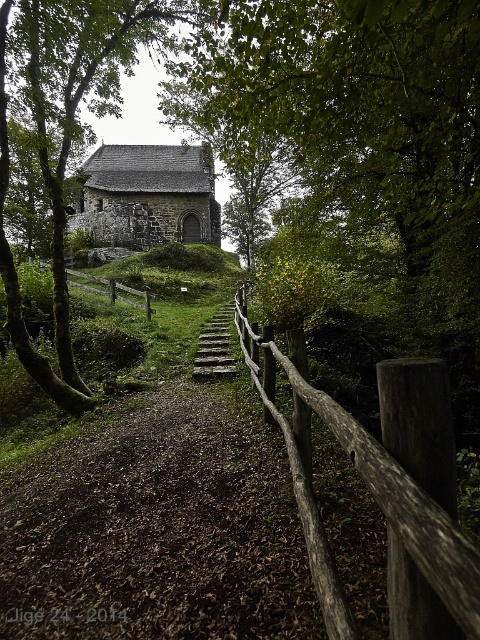
Question: Which is nearer to the stone church at center?

Choices:
 (A) brown wooden fence at center
 (B) stone steps at center

Answer: (A)

Question: Which object is positioned farthest from the rustic wooden fence at center?

Choices:
 (A) stone church at center
 (B) brown wooden fence at center

Answer: (A)

Question: Does stone church at center have a larger size compared to stone steps at center?

Choices:
 (A) yes
 (B) no

Answer: (A)

Question: Can you confirm if rustic wooden fence at center is positioned to the left of stone steps at center?

Choices:
 (A) yes
 (B) no

Answer: (B)

Question: Where is stone church at center located in relation to stone steps at center in the image?

Choices:
 (A) below
 (B) above

Answer: (B)

Question: Which object is the farthest from the rustic wooden fence at center?

Choices:
 (A) brown wooden fence at center
 (B) stone church at center
 (C) stone steps at center

Answer: (B)